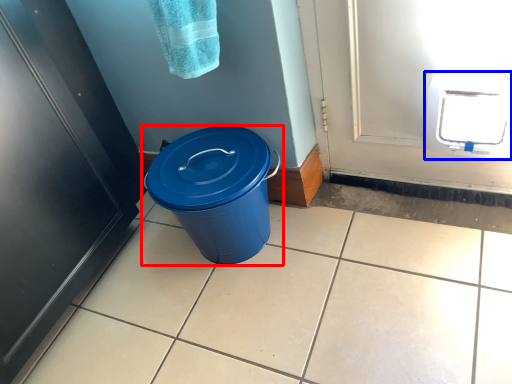
Question: Which point is closer to the camera, waste container (highlighted by a red box) or appliance (highlighted by a blue box)?

Choices:
 (A) waste container
 (B) appliance

Answer: (B)